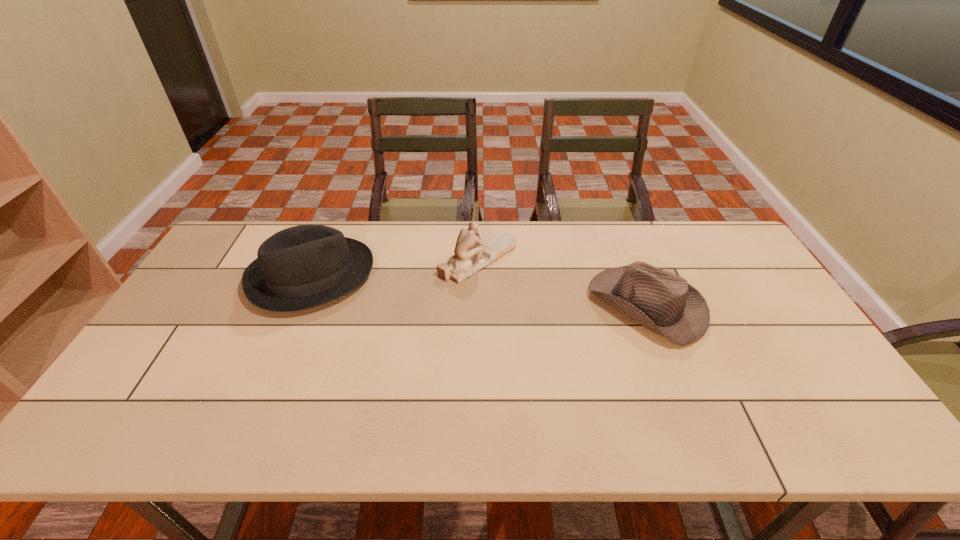
The image size is (960, 540). I want to click on the left fedora, so click(301, 267).

You are a GUI agent. You are given a task and a screenshot of the screen. Output one action in this format:
    pyautogui.click(x=<x>, y=<y>)
    Task: Click on the leftmost object
    
    Given the screenshot: What is the action you would take?
    pyautogui.click(x=301, y=267)

This screenshot has width=960, height=540. What are the coordinates of `the second object from left to right` in the screenshot? It's located at (472, 254).

Locate an element on the screen. This screenshot has height=540, width=960. the rightmost object is located at coordinates (664, 303).

You are a GUI agent. You are given a task and a screenshot of the screen. Output one action in this format:
    pyautogui.click(x=<x>, y=<y>)
    Task: Click on the right fedora
    This screenshot has height=540, width=960.
    Given the screenshot: What is the action you would take?
    pyautogui.click(x=664, y=303)

I want to click on free space located on the right of the taller fedora, so click(486, 276).

Locate an element on the screen. free space located 0.280m on the front-facing side of the second object from right to left is located at coordinates (604, 260).

Image resolution: width=960 pixels, height=540 pixels. Identify the location of vacant area situated on the front of the rightmost object. (691, 418).

You are a GUI agent. You are given a task and a screenshot of the screen. Output one action in this format:
    pyautogui.click(x=<x>, y=<y>)
    Task: Click on the fedora at the far edge
    
    Given the screenshot: What is the action you would take?
    pyautogui.click(x=301, y=267)

This screenshot has height=540, width=960. Identify the location of figurine that is at the far edge. (472, 254).